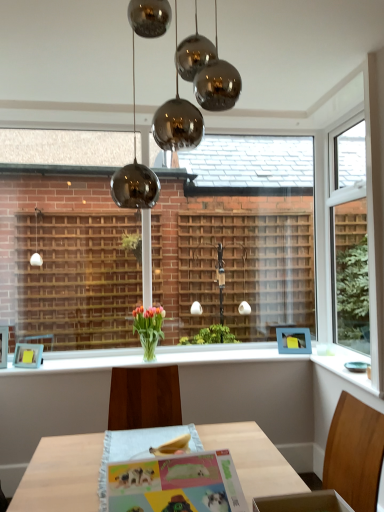
Image resolution: width=384 pixels, height=512 pixels. I want to click on free space above white glossy plate at lower right, acting as the 2th window sill starting from the left (from a real-world perspective), so click(344, 361).